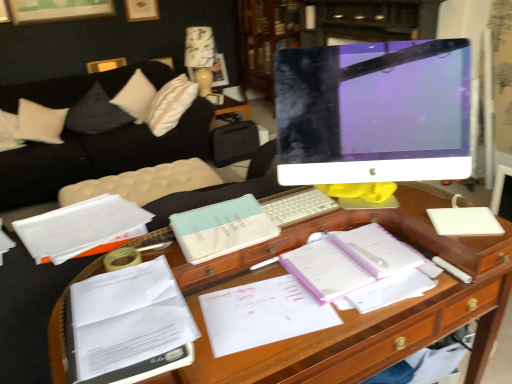
Question: From the image's perspective, relative to white paper at lower left, which ranks as the 3th book in back-to-front order, is wooden bookshelf at upper center above or below?

Choices:
 (A) below
 (B) above

Answer: (B)

Question: Is wooden bookshelf at upper center spatially inside white paper at lower left, which ranks as the 3th book in back-to-front order, or outside of it?

Choices:
 (A) outside
 (B) inside

Answer: (A)

Question: Which of these objects is positioned closest to the white paper at left, the first book from the back?

Choices:
 (A) patterned fabric lampshade at upper center
 (B) wooden desk at center
 (C) purple spiral notebook at center
 (D) light blue matte notebook at center, which is the second book from front to back
 (E) white soft pillow at upper left, placed as the first pillow when sorted from right to left

Answer: (D)

Question: Which object is positioned closest to the purple spiral notebook at center?

Choices:
 (A) white paper at center
 (B) light blue matte notebook at center, acting as the second book starting from the back
 (C) wooden desk at center
 (D) white soft pillow at upper left, which ranks as the 2th pillow in left-to-right order
 (E) black fabric pillow at left, marked as the first pillow in a left-to-right arrangement

Answer: (C)